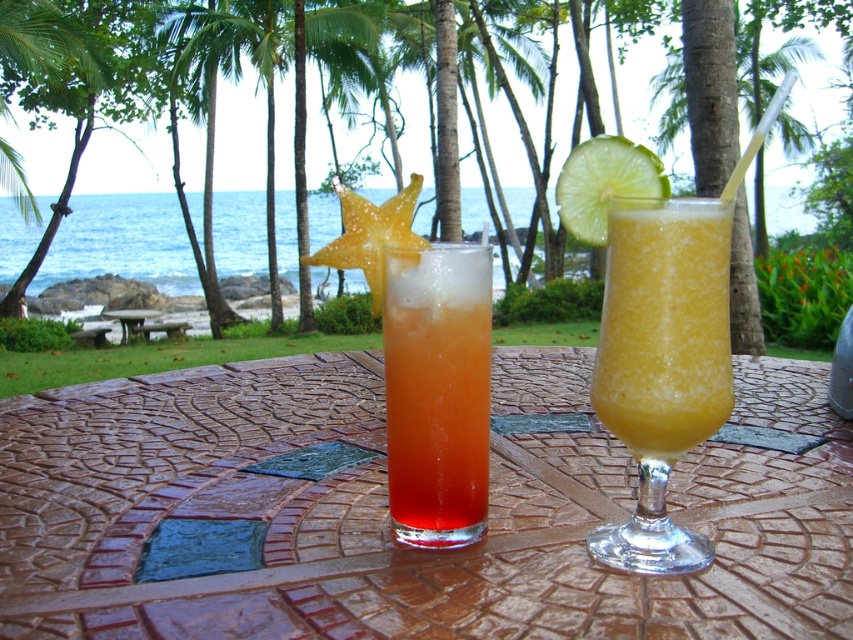
Does point (405, 288) come behind point (450, 540)?

No.

Does translucent glass at center lie behind translucent orange drink at center?

No, it is not.

Locate an element on the screen. The image size is (853, 640). translucent glass at center is located at coordinates (426, 364).

Is yellow frosted glass at right in front of green matte lime at upper right?

That is True.

Can you confirm if yellow frosted glass at right is thinner than green matte lime at upper right?

Incorrect, yellow frosted glass at right's width is not less than green matte lime at upper right's.

Is point (703, 355) positioned after point (624, 173)?

No, (703, 355) is in front of (624, 173).

Image resolution: width=853 pixels, height=640 pixels. In order to click on yellow frosted glass at right in this screenshot , I will do `click(664, 324)`.

Does point (689, 557) come farther from viewer compared to point (142, 317)?

No, it is in front of (142, 317).

Which of these two, smooth yellow slushie at center or brown textured table at center, stands shorter?

Standing shorter between the two is smooth yellow slushie at center.

Who is more distant from viewer, [608,544] or [132,310]?

Point [132,310]

This screenshot has width=853, height=640. In order to click on smooth yellow slushie at center in this screenshot , I will do `click(656, 326)`.